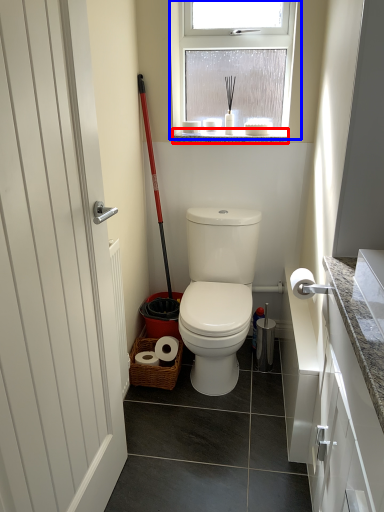
Question: Which object is further to the camera taking this photo, window sill (highlighted by a red box) or window (highlighted by a blue box)?

Choices:
 (A) window sill
 (B) window

Answer: (A)